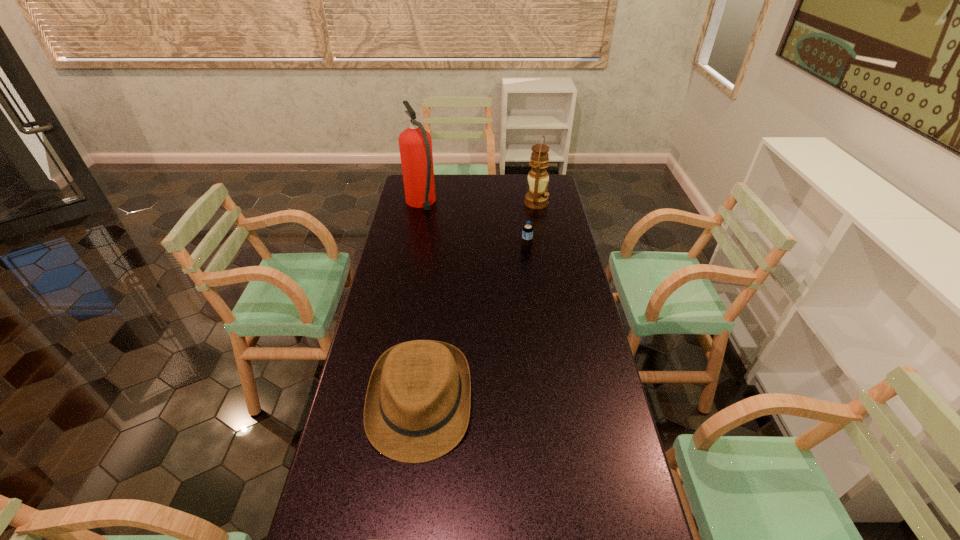
Where is `fire extinguisher`? fire extinguisher is located at coordinates (415, 144).

Locate an element on the screen. The image size is (960, 540). oil lamp is located at coordinates (537, 198).

I want to click on soda bottle, so click(527, 232).

Find the location of a particular element. fedora is located at coordinates [417, 407].

Identify the location of free location located 0.060m on the handle side of the tallest object. (424, 184).

Locate an element on the screen. This screenshot has height=540, width=960. free space located on the handle side of the tallest object is located at coordinates (425, 180).

The height and width of the screenshot is (540, 960). Find the location of `free point located 0.140m on the handle side of the tallest object`. free point located 0.140m on the handle side of the tallest object is located at coordinates (426, 177).

Locate an element on the screen. Image resolution: width=960 pixels, height=540 pixels. blank space located on the left of the second tallest object is located at coordinates (451, 204).

Where is `vacant position located 0.130m on the right of the soda bottle`? vacant position located 0.130m on the right of the soda bottle is located at coordinates point(563,249).

This screenshot has height=540, width=960. In order to click on vacant space located 0.170m on the front-facing side of the nearest object in this screenshot , I will do `click(405, 535)`.